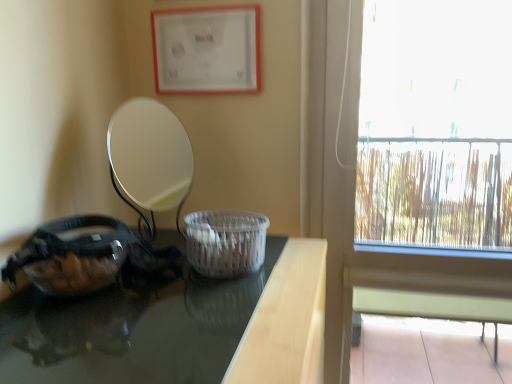
The width and height of the screenshot is (512, 384). I want to click on free space in front of white woven basket at center, so click(x=216, y=304).